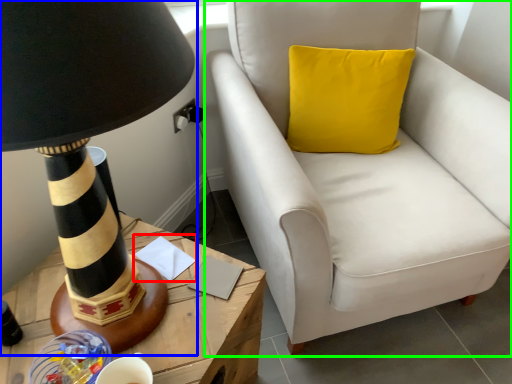
Question: Based on their relative distances, which object is nearer to notepad (highlighted by a red box)? Choose from lamp (highlighted by a blue box) and chair (highlighted by a green box).

Choices:
 (A) lamp
 (B) chair

Answer: (A)